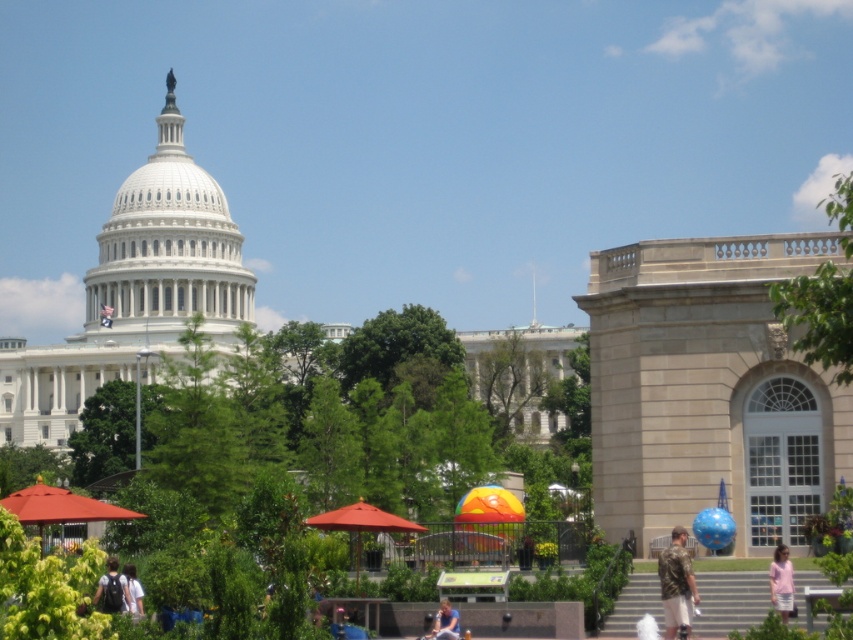
You are standing at the entrance of the grand neoclassical building and notice a person with light brown hair at lower center. If you want to approach them, in which direction should you move relative to the building?

The light brown hair at lower center is located at point 0.973 on the x and 0.523 on the y. Since the coordinates are close to the lower right corner, you should move towards the right side of the building to reach them.

You are standing at the entrance of the grand neoclassical building and see a matte orange umbrella at center and a person with light brown hair at lower center. Which object is positioned to the left from your viewpoint?

The matte orange umbrella at center is to the left of the light brown hair at lower center from your viewpoint.